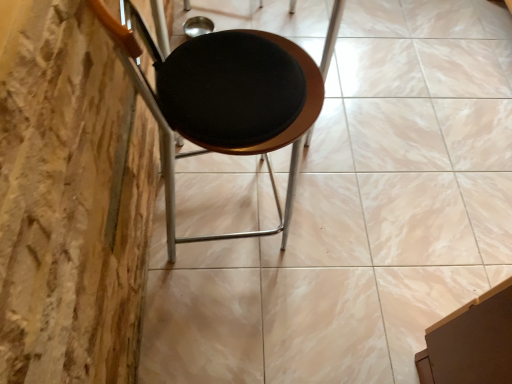
At what (x,y) coordinates should I click in order to perform the action: click on vacant space to the right of matte black stool at center. Please return your answer as a coordinate pair (x, y). Image resolution: width=512 pixels, height=384 pixels. Looking at the image, I should click on (356, 222).